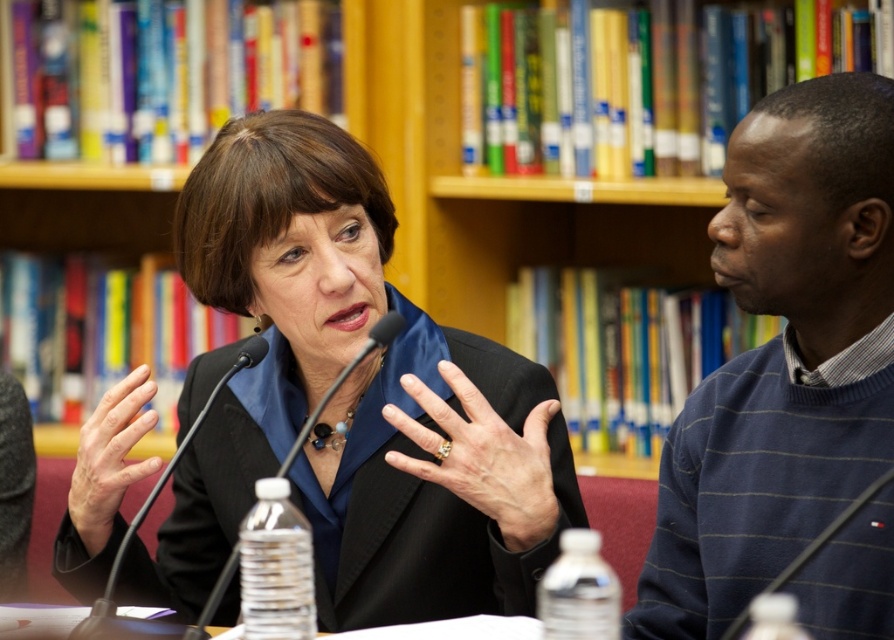
You are attending a presentation in the library and notice two items of interest. The blue striped sweater at right and the black matte microphone at center. Which item is positioned farther to the east in the scene?

The blue striped sweater at right is positioned to the right of the black matte microphone at center, so it is farther to the east in the scene.

You are a photographer setting up for an event and need to ensure that both the black matte suit at center and the black plastic microphone at center are clearly visible in your shot. Given their height difference, which one might require you to adjust your camera angle to capture properly?

The black matte suit at center is much taller than the black plastic microphone at center, so you might need to adjust your camera angle to ensure both are visible. Since the suit is taller, you might need to tilt the camera slightly upward to include its full height while still capturing the microphone at the base.